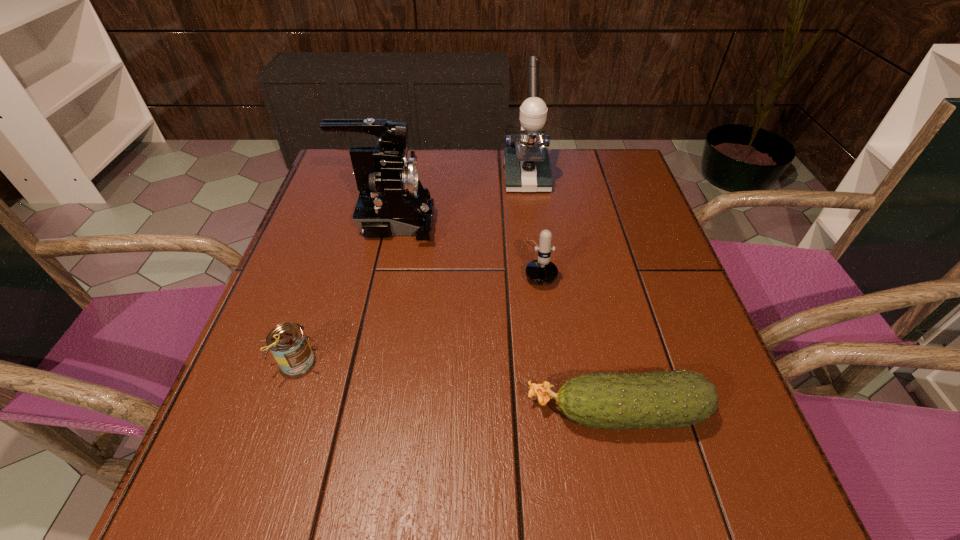
In the image, there is a desktop. Identify the location of vacant space at the right edge. (687, 442).

Image resolution: width=960 pixels, height=540 pixels. I want to click on vacant space at the far left corner of the desktop, so click(344, 173).

Where is `vacant space at the near left corner of the desktop`? vacant space at the near left corner of the desktop is located at coordinates (245, 460).

You are a GUI agent. You are given a task and a screenshot of the screen. Output one action in this format:
    pyautogui.click(x=<x>, y=<y>)
    Task: Click on the empty space between the camcorder and the cucumber
    The width and height of the screenshot is (960, 540).
    Given the screenshot: What is the action you would take?
    pyautogui.click(x=504, y=317)

I want to click on blank region between the microphone and the can, so click(x=418, y=312).

The height and width of the screenshot is (540, 960). What are the coordinates of `free space between the camcorder and the cucumber` in the screenshot? It's located at (504, 317).

Find the location of `vacant area between the nearest object and the microphone`. vacant area between the nearest object and the microphone is located at coordinates (578, 337).

You are a GUI agent. You are given a task and a screenshot of the screen. Output one action in this format:
    pyautogui.click(x=<x>, y=<y>)
    Task: Click on the vacant space that's between the camcorder and the microscope
    This screenshot has width=960, height=540.
    Given the screenshot: What is the action you would take?
    pyautogui.click(x=459, y=200)

This screenshot has height=540, width=960. I want to click on unoccupied position between the microphone and the farthest object, so click(x=532, y=220).

Where is `free space between the microscope and the cucumber`? Image resolution: width=960 pixels, height=540 pixels. free space between the microscope and the cucumber is located at coordinates (571, 294).